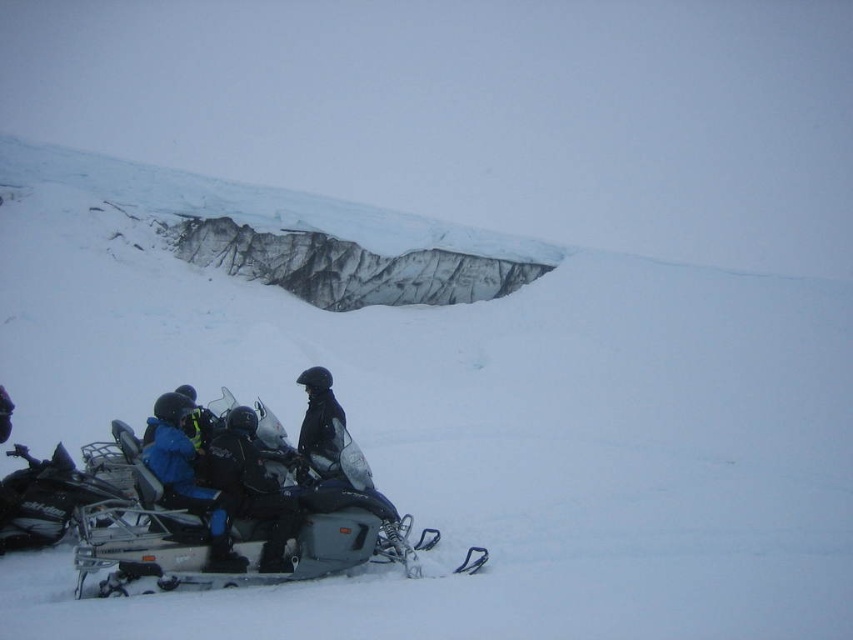
You are planning to transport a large cargo box that requires a wider vehicle. Based on the image, which snowmobile between the metallic silver snowmobile at lower center and the metallic silver snowmobile at lower left would you choose?

The metallic silver snowmobile at lower center might be wider than the metallic silver snowmobile at lower left, so you should choose the metallic silver snowmobile at lower center for transporting the large cargo box.

You are planning to take a photo of the black matte snowmobile at lower left and the blue fabric jacket at lower left. Which object should you focus on first if you want to capture both in the same frame without moving the camera?

The black matte snowmobile at lower left is smaller than the blue fabric jacket at lower left, so you should focus on the blue fabric jacket at lower left first to ensure both are in frame.

You are a snowmobile rider planning to take a photo of the black matte jacket at center. Since the metallic silver snowmobile at lower center is blocking your view, can you move to the left or right to get a clear shot without moving the jacket?

The metallic silver snowmobile at lower center is in front of the black matte jacket at center, so moving to the left or right should allow you to position yourself around the snowmobile and get a clear view of the jacket.